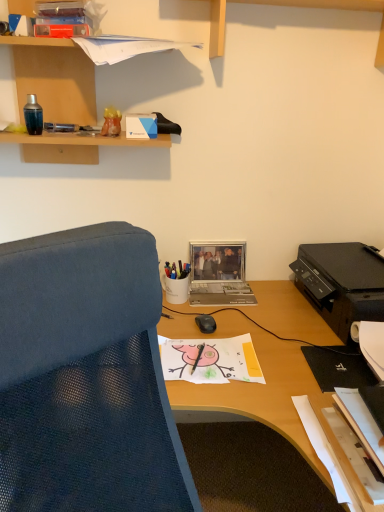
What are the coordinates of `free space in front of black matte pen at center, the first pen from the right` in the screenshot? It's located at (197, 377).